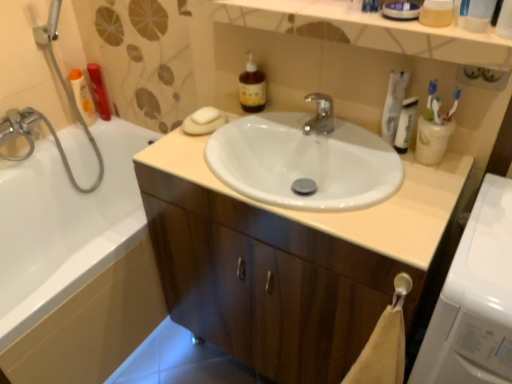
Image resolution: width=512 pixels, height=384 pixels. What are the coordinates of `free space in front of white plastic cup at upper right` in the screenshot? It's located at (425, 196).